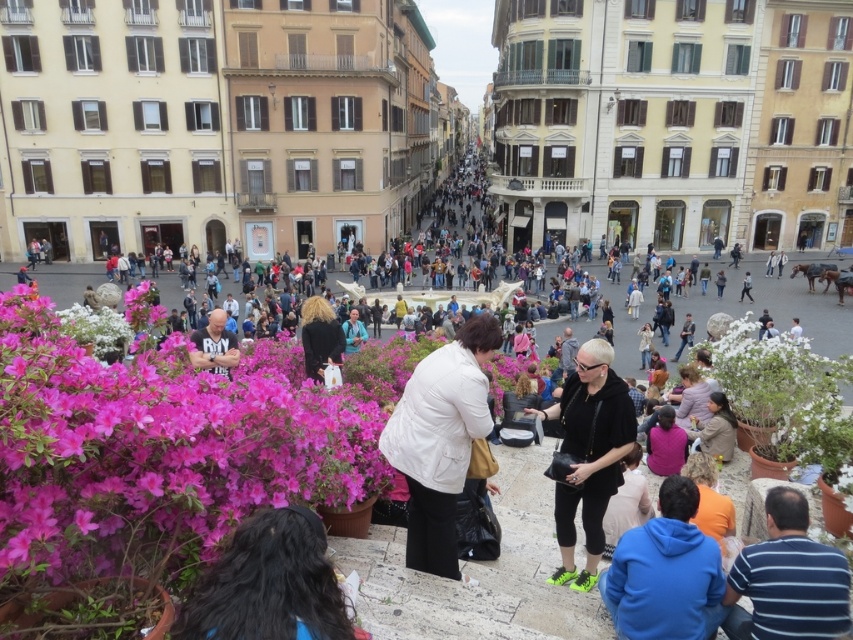
Does black leather jacket at center appear over black fabric jacket at center?

Actually, black leather jacket at center is below black fabric jacket at center.

Does point (555, 512) lie behind point (321, 365)?

No, it is in front of (321, 365).

Does point (566, 420) come farther from viewer compared to point (306, 346)?

That is False.

Locate an element on the screen. The height and width of the screenshot is (640, 853). black leather jacket at center is located at coordinates (589, 454).

Is pink matte flowers at lower left closer to camera compared to black fabric jacket at center?

Yes, it is.

Which is more to the left, pink matte flowers at lower left or black fabric jacket at center?

From the viewer's perspective, pink matte flowers at lower left appears more on the left side.

Is point (3, 368) positioned after point (322, 376)?

No, (3, 368) is closer to viewer.

Find the location of a particular element. Image resolution: width=853 pixels, height=640 pixels. pink matte flowers at lower left is located at coordinates (157, 451).

Based on the photo, between white matte jacket at center and blue denim jeans at center, which one has less height?

blue denim jeans at center

Consider the image. Can you confirm if white matte jacket at center is positioned to the right of blue denim jeans at center?

Correct, you'll find white matte jacket at center to the right of blue denim jeans at center.

Identify the location of white matte jacket at center. point(440,440).